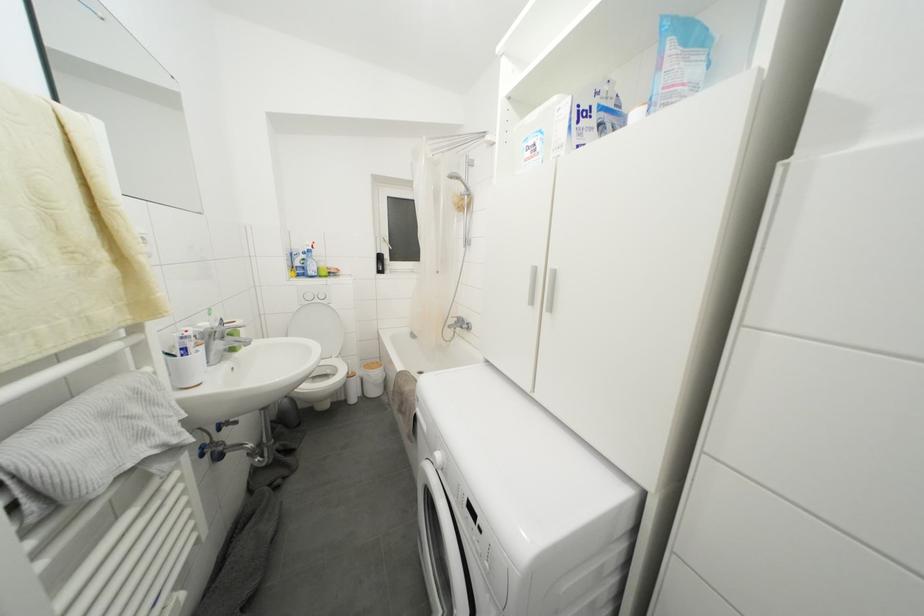
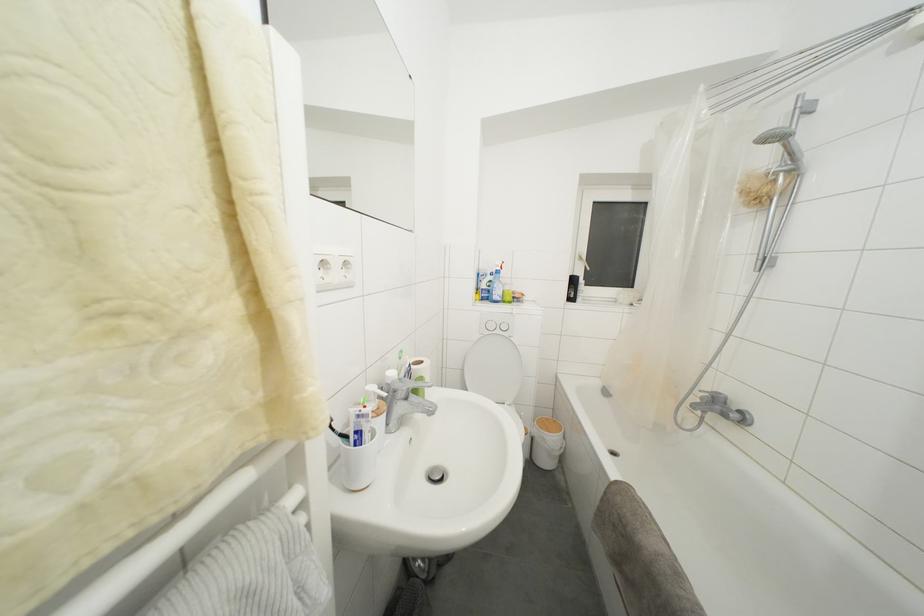
In the second image, find the point that corresponds to (187,342) in the first image.

(362, 421)